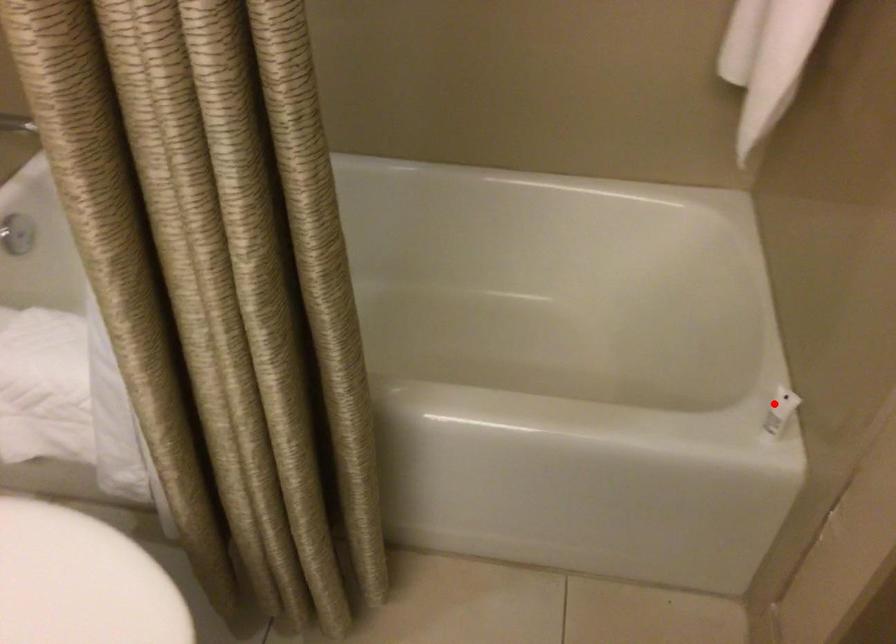
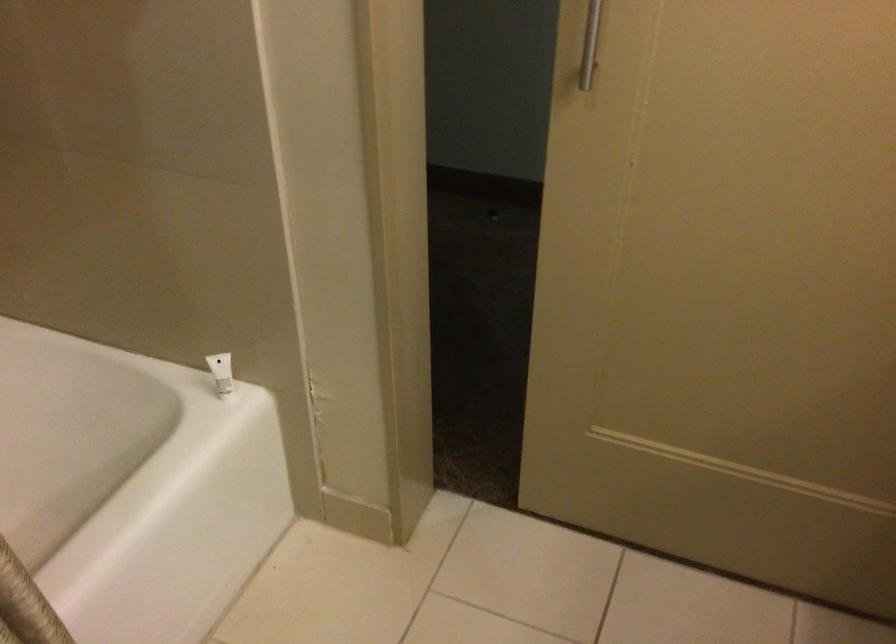
The point at the highlighted location is marked in the first image. Where is the corresponding point in the second image?

(220, 372)